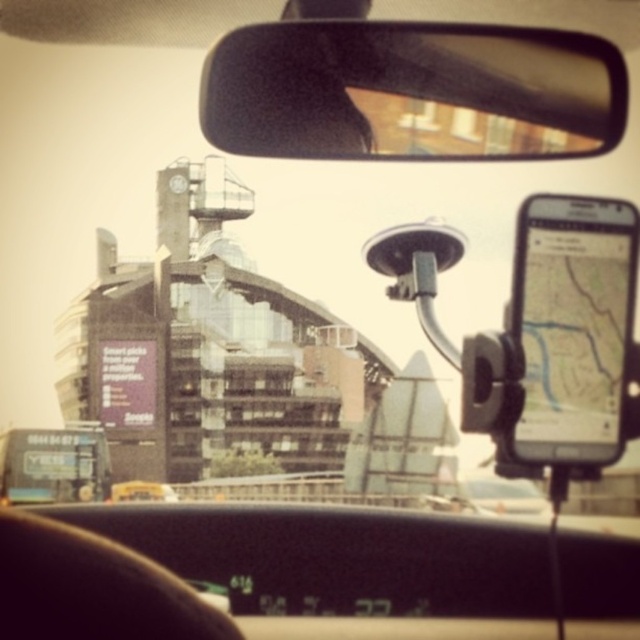
You are driving a car and need to check both the clear plastic mirror at upper center and the metallic billboard at lower left. Which object is positioned to the right side from your viewpoint?

The clear plastic mirror at upper center is to the right of the metallic billboard at lower left, so it is positioned to the right side from your viewpoint.

You are sitting in the driver seat of the car shown in the scene. You see two points marked in the image, one at coordinates point (252,64) and another at point (77,468). Which point is closer to you?

Point (252,64) is closer to the viewer than point (77,468).